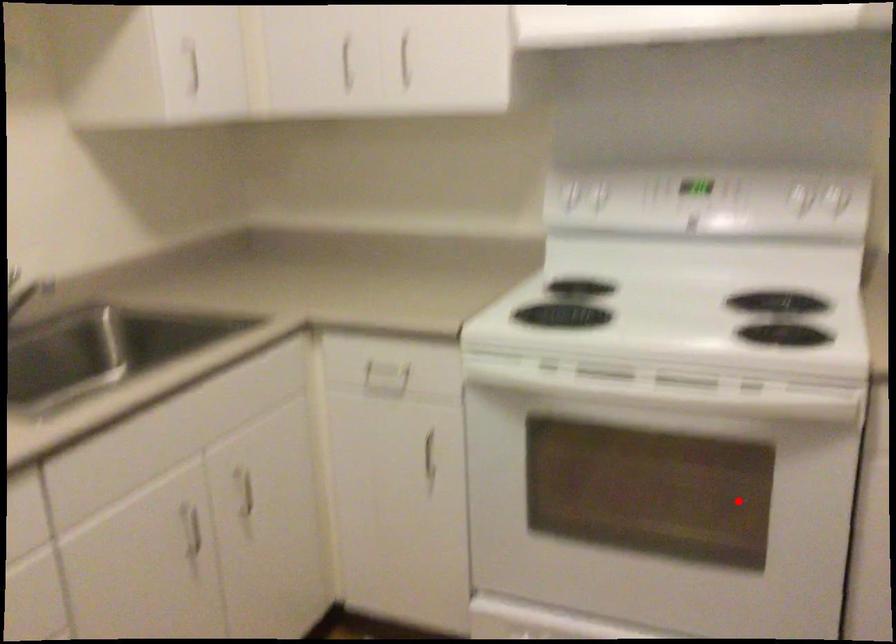
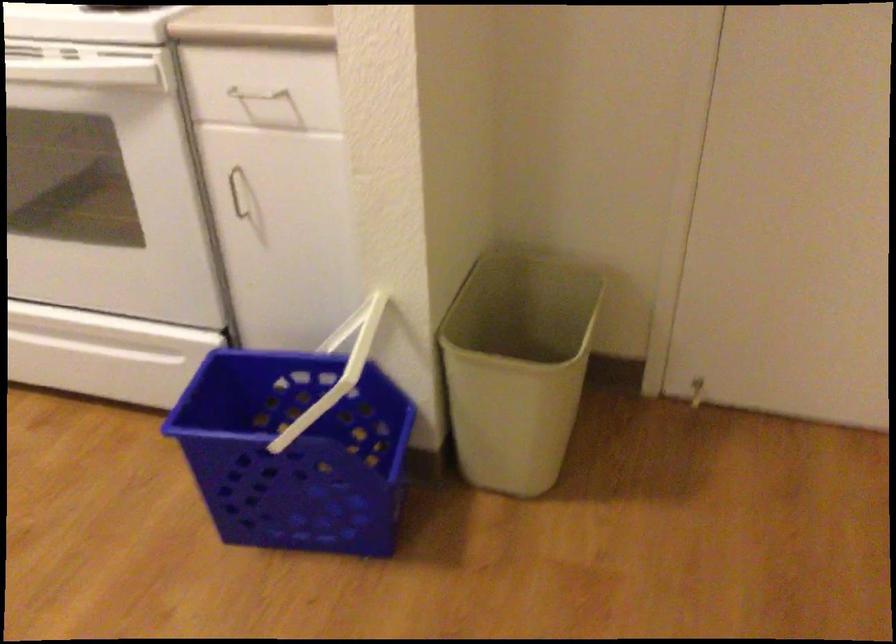
Locate, in the second image, the point that corresponds to the highlighted location in the first image.

(104, 185)